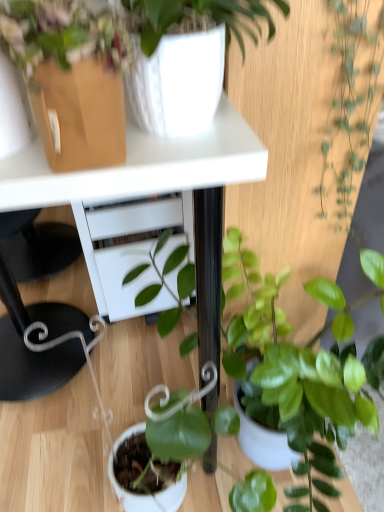
Question: From a real-world perspective, is white glossy table at upper center on white glossy vase at upper center, which ranks as the 2th houseplant in bottom-to-top order?

Choices:
 (A) yes
 (B) no

Answer: (B)

Question: Does white glossy table at upper center have a greater width compared to white glossy vase at upper center, positioned as the second houseplant in top-to-bottom order?

Choices:
 (A) no
 (B) yes

Answer: (B)

Question: Can we say white glossy table at upper center lies outside white glossy vase at upper center, positioned as the second houseplant in top-to-bottom order?

Choices:
 (A) yes
 (B) no

Answer: (A)

Question: Considering the relative sizes of white glossy table at upper center and white glossy vase at upper center, which ranks as the 2th houseplant in bottom-to-top order, in the image provided, is white glossy table at upper center smaller than white glossy vase at upper center, which ranks as the 2th houseplant in bottom-to-top order,?

Choices:
 (A) no
 (B) yes

Answer: (A)

Question: Is white glossy table at upper center facing towards white glossy vase at upper center, which ranks as the 2th houseplant in bottom-to-top order?

Choices:
 (A) yes
 (B) no

Answer: (B)

Question: From the image's perspective, would you say white glossy table at upper center is positioned over white glossy vase at upper center, which ranks as the 2th houseplant in bottom-to-top order?

Choices:
 (A) no
 (B) yes

Answer: (A)

Question: From a real-world perspective, is white glossy table at upper center under green glossy plant at right, which is the first houseplant in top-to-bottom order?

Choices:
 (A) yes
 (B) no

Answer: (A)

Question: Can you confirm if white glossy table at upper center is thinner than green glossy plant at right, which is the first houseplant in top-to-bottom order?

Choices:
 (A) no
 (B) yes

Answer: (A)

Question: Does white glossy table at upper center have a lesser height compared to green glossy plant at right, which is the first houseplant in top-to-bottom order?

Choices:
 (A) no
 (B) yes

Answer: (A)

Question: Considering the relative sizes of white glossy table at upper center and green glossy plant at right, the 3th houseplant in the bottom-to-top sequence, in the image provided, is white glossy table at upper center taller than green glossy plant at right, the 3th houseplant in the bottom-to-top sequence,?

Choices:
 (A) no
 (B) yes

Answer: (B)

Question: Is white glossy table at upper center wider than green glossy plant at right, the 3th houseplant in the bottom-to-top sequence?

Choices:
 (A) no
 (B) yes

Answer: (B)

Question: Is white glossy table at upper center further to the viewer compared to green glossy plant at right, the 3th houseplant in the bottom-to-top sequence?

Choices:
 (A) yes
 (B) no

Answer: (B)

Question: From the image's perspective, is green glossy plant at center, which is counted as the 3th houseplant, starting from the top, under green glossy plant at right, which is the first houseplant in top-to-bottom order?

Choices:
 (A) yes
 (B) no

Answer: (A)